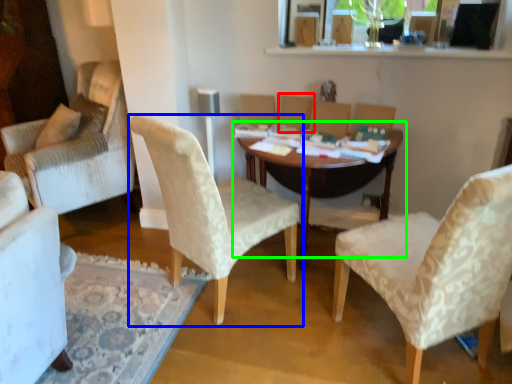
Question: Based on their relative distances, which object is nearer to armchair (highlighted by a red box)? Choose from chair (highlighted by a blue box) and table (highlighted by a green box).

Choices:
 (A) chair
 (B) table

Answer: (B)